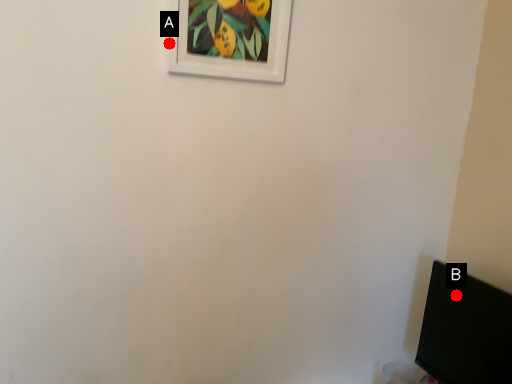
Question: Two points are circled on the image, labeled by A and B beside each circle. Which point is farther to the camera?

Choices:
 (A) A is further
 (B) B is further

Answer: (B)